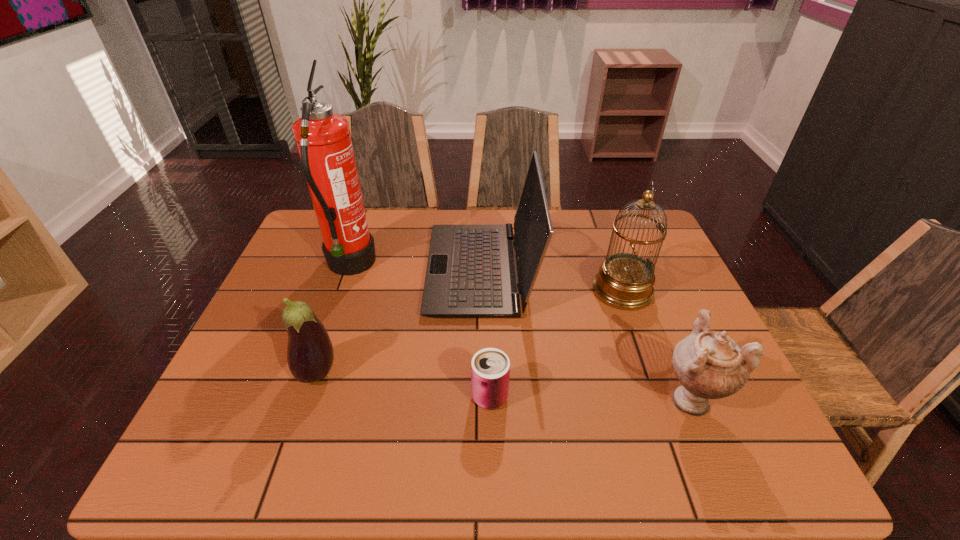
Identify the location of vacant point located between the can and the fifth shortest object. (556, 343).

The height and width of the screenshot is (540, 960). I want to click on vacant area between the shortest object and the urn, so tap(589, 397).

The height and width of the screenshot is (540, 960). I want to click on free space that is in between the second tallest object and the laptop computer, so click(552, 280).

The width and height of the screenshot is (960, 540). Identify the location of blank region between the eggplant and the shortest object. (403, 384).

The image size is (960, 540). I want to click on free space between the laptop computer and the urn, so click(586, 333).

At what (x,y) coordinates should I click in order to perform the action: click on free space that is in between the second tallest object and the can. Please return your answer as a coordinate pair (x, y). Looking at the image, I should click on (556, 343).

The image size is (960, 540). I want to click on empty space between the laptop computer and the fire extinguisher, so click(416, 268).

At what (x,y) coordinates should I click in order to perform the action: click on vacant area between the urn and the can. Please return your answer as a coordinate pair (x, y). The image size is (960, 540). Looking at the image, I should click on (589, 397).

Identify the location of object that stands as the fifth closest to the fifth shortest object. (310, 355).

You are a GUI agent. You are given a task and a screenshot of the screen. Output one action in this format:
    pyautogui.click(x=<x>, y=<y>)
    Task: Click on the object that is the closest to the can
    The image size is (960, 540).
    Given the screenshot: What is the action you would take?
    click(x=471, y=273)